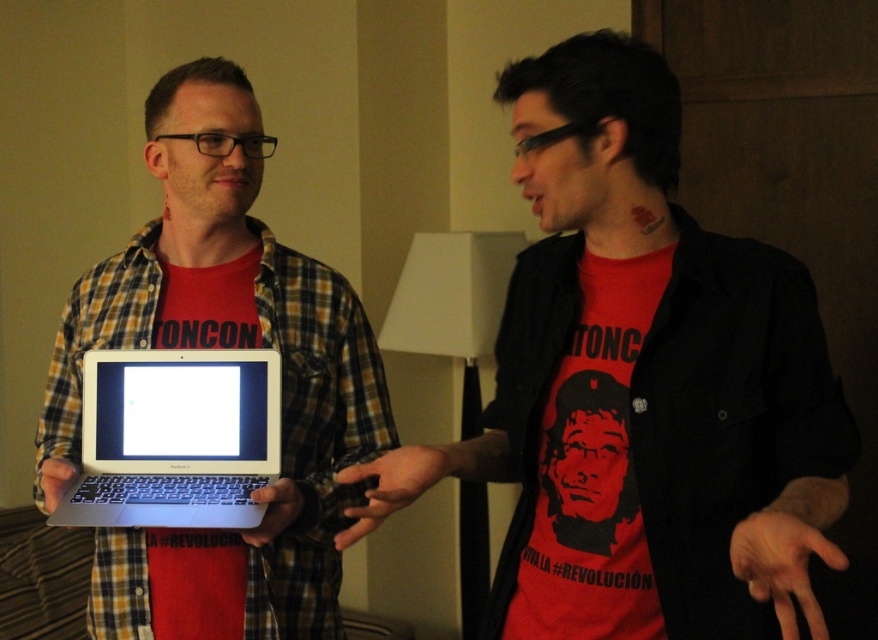
Question: Which of the following is the closest to the observer?

Choices:
 (A) (90, 499)
 (B) (620, 381)
 (C) (366, 364)

Answer: (B)

Question: Is matte black shirt at center to the right of silver metallic laptop at center from the viewer's perspective?

Choices:
 (A) yes
 (B) no

Answer: (A)

Question: Which point is closer to the camera taking this photo?

Choices:
 (A) (211, 129)
 (B) (576, 301)
 (C) (222, 365)

Answer: (B)

Question: Does matte black shirt at center have a larger size compared to silver metallic laptop at left?

Choices:
 (A) yes
 (B) no

Answer: (A)

Question: Which point appears farthest from the camera in this image?

Choices:
 (A) (253, 269)
 (B) (774, 545)
 (C) (83, 509)

Answer: (A)

Question: Does silver metallic laptop at left have a larger size compared to silver metallic laptop at center?

Choices:
 (A) yes
 (B) no

Answer: (A)